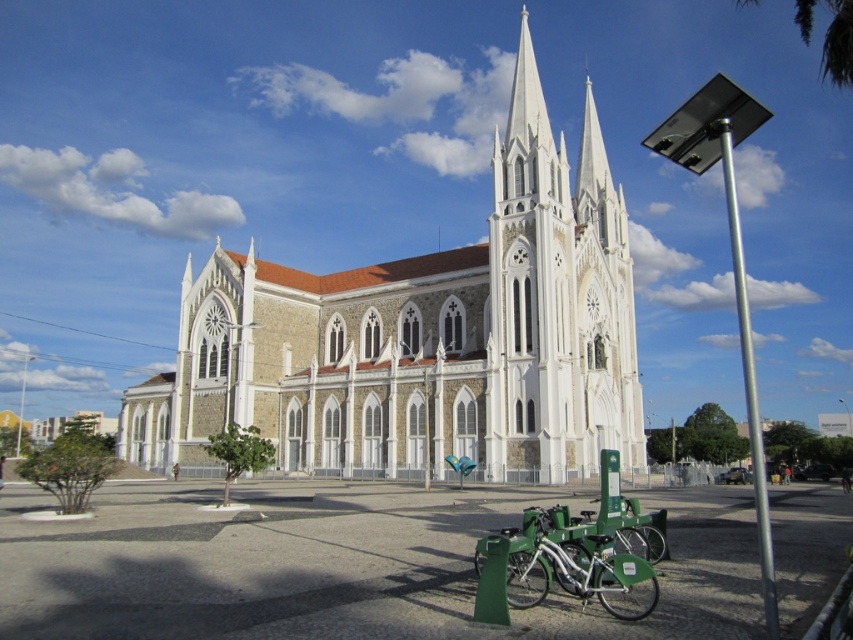
Question: Which is nearer to the white stone church at center?

Choices:
 (A) green matte bicycle at lower center
 (B) silver metallic pole at right

Answer: (A)

Question: Is white stone church at center wider than green matte bicycle at lower center?

Choices:
 (A) no
 (B) yes

Answer: (B)

Question: Does white stone church at center have a greater width compared to green matte bicycle at lower center?

Choices:
 (A) yes
 (B) no

Answer: (A)

Question: Which point is closer to the camera taking this photo?

Choices:
 (A) (281, 419)
 (B) (585, 515)

Answer: (B)

Question: Which object is positioned closest to the silver metallic pole at right?

Choices:
 (A) white stone church at center
 (B) green matte bicycle at lower center

Answer: (B)

Question: Can you confirm if white stone church at center is bigger than silver metallic pole at right?

Choices:
 (A) yes
 (B) no

Answer: (A)